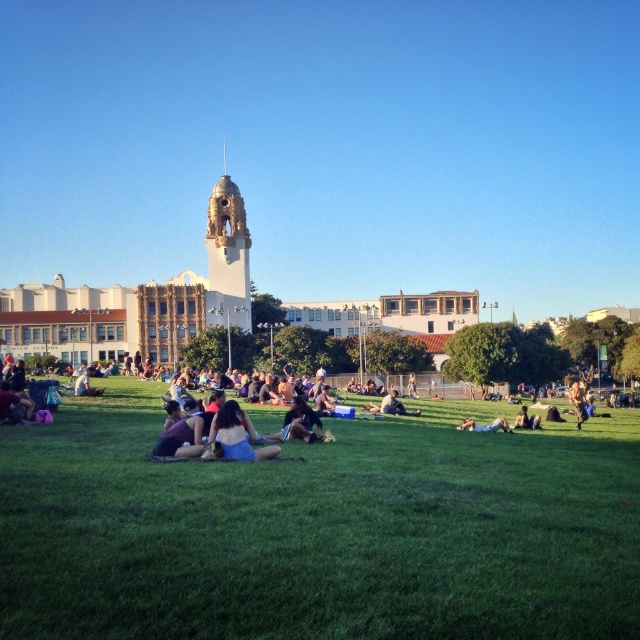
Question: Which is farther from the matte black shirt at center?

Choices:
 (A) denim shorts at center
 (B) matte black jacket at lower left
 (C) matte black jacket at center
 (D) green grassy field at center

Answer: (C)

Question: Can you confirm if matte black shirt at center is wider than matte black jacket at center?

Choices:
 (A) yes
 (B) no

Answer: (A)

Question: Can you confirm if green grassy field at center is thinner than matte black shirt at center?

Choices:
 (A) yes
 (B) no

Answer: (B)

Question: Which point is closer to the camera taking this photo?

Choices:
 (A) (13, 410)
 (B) (17, 604)
 (C) (301, 413)

Answer: (B)

Question: Observing the image, what is the correct spatial positioning of green grassy field at center in reference to gold textured clock tower at center?

Choices:
 (A) left
 (B) right

Answer: (B)

Question: Which object appears closest to the camera in this image?

Choices:
 (A) dark blue jeans at center
 (B) matte black jacket at lower left
 (C) blue denim jeans at lower right

Answer: (A)